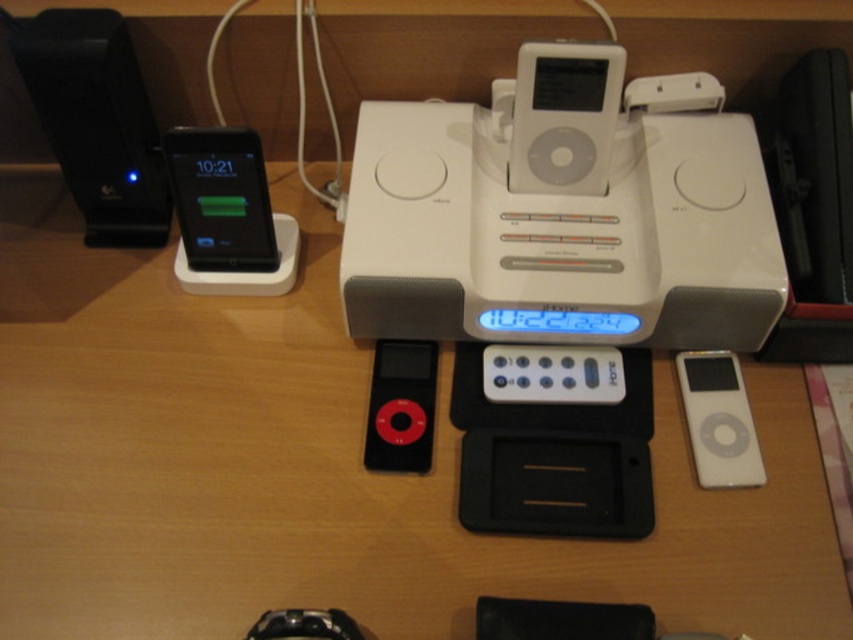
You are organizing your desk and want to place the red matte ipod nano at center and the white plastic remote at center in a drawer. If the drawer can only hold items arranged from left to right, which item should be placed first to match their current positions?

The red matte ipod nano at center should be placed first in the drawer since it is positioned on the left side of the white plastic remote at center, so placing it first will maintain their left to right arrangement.

You are organizing a desk and need to place the red matte ipod nano at center and the white plastic remote at center into a drawer. Which object will occupy more vertical space in the drawer?

The red matte ipod nano at center is much taller than the white plastic remote at center, so it will occupy more vertical space in the drawer.

You are holding a ruler and want to measure the distance from your eyes to the point labeled as point (427,220) in the image. What is the actual distance in inches?

The point (427,220) is 30.54 inches away from the viewer, so the actual distance is 30.54 inches.